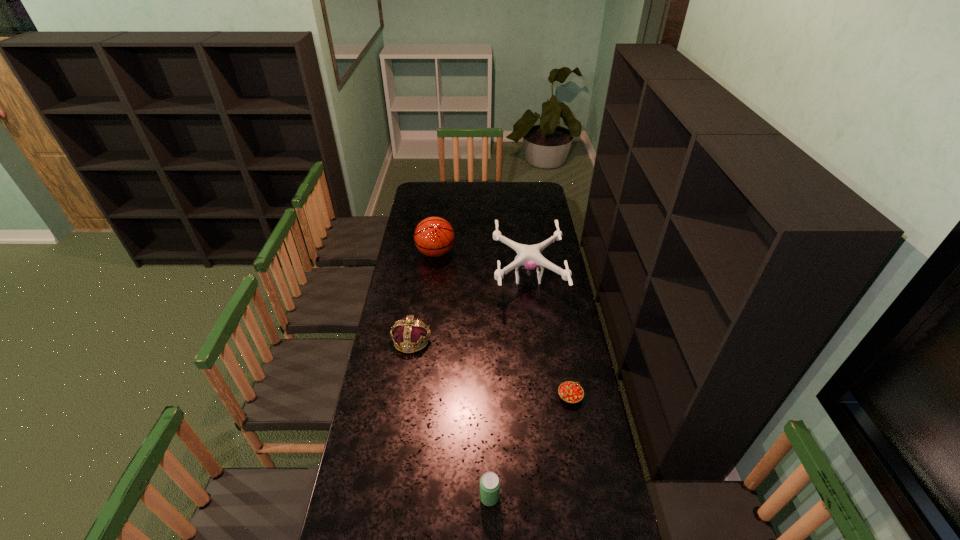
The image size is (960, 540). Identify the location of the tallest object. (434, 236).

Where is `the second tallest object`? This screenshot has height=540, width=960. the second tallest object is located at coordinates (528, 257).

This screenshot has height=540, width=960. Find the location of `the third nearest object`. the third nearest object is located at coordinates (410, 331).

Locate an element on the screen. Image resolution: width=960 pixels, height=540 pixels. the third object from left to right is located at coordinates click(489, 483).

Where is `soda`? This screenshot has width=960, height=540. soda is located at coordinates (489, 483).

The height and width of the screenshot is (540, 960). I want to click on the second nearest object, so click(x=571, y=392).

In order to click on strawberry in this screenshot , I will do `click(571, 392)`.

The height and width of the screenshot is (540, 960). Identify the location of vacant space situated 0.270m on the side with spill of the tallest object. (506, 253).

This screenshot has height=540, width=960. In order to click on vacant space located on the top of the drone in this screenshot , I will do `click(431, 278)`.

Where is `free region located 0.190m on the top of the drone`? The width and height of the screenshot is (960, 540). free region located 0.190m on the top of the drone is located at coordinates click(455, 278).